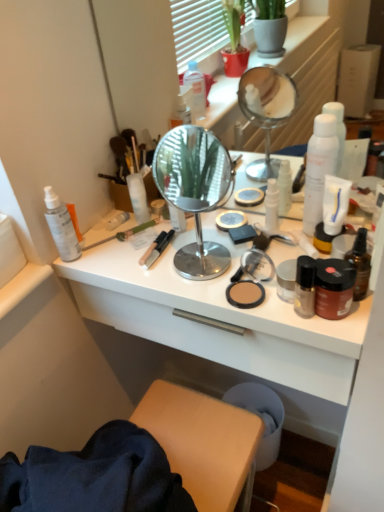
Where is `vacant area that lies between clear plastic tube at center, marked as the sixth toiletry in a right-to-left arrangement, and white matte spray can at right, which is the first bottle from top to bottom`? The height and width of the screenshot is (512, 384). vacant area that lies between clear plastic tube at center, marked as the sixth toiletry in a right-to-left arrangement, and white matte spray can at right, which is the first bottle from top to bottom is located at coordinates pyautogui.click(x=207, y=227).